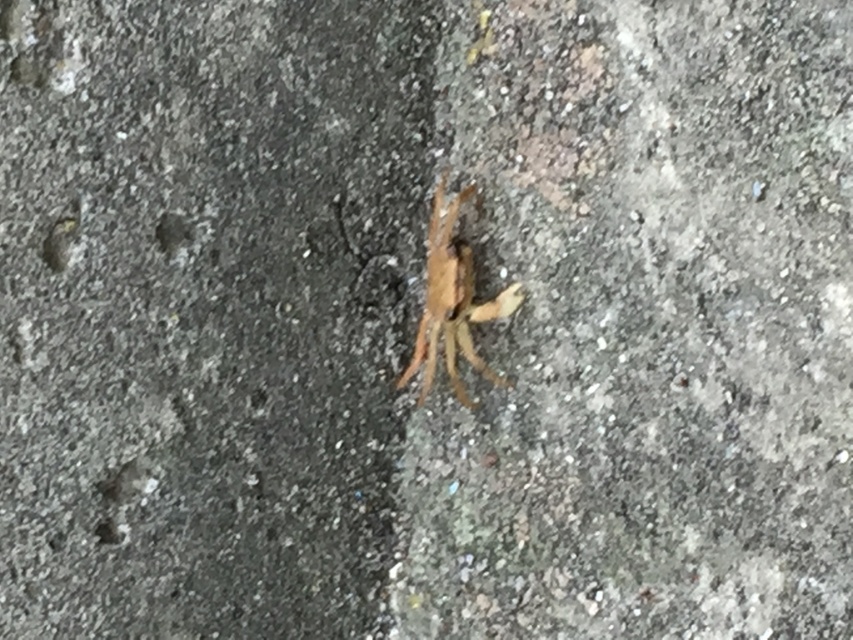
Question: Does gray rough concrete at center come behind brown rough concrete at center?

Choices:
 (A) yes
 (B) no

Answer: (B)

Question: Is brown rough concrete at center bigger than brown fuzzy spider at center?

Choices:
 (A) yes
 (B) no

Answer: (A)

Question: Which of these objects is positioned closest to the gray rough concrete at center?

Choices:
 (A) brown fuzzy spider at center
 (B) brown rough concrete at center

Answer: (A)

Question: Does brown rough concrete at center have a greater width compared to brown fuzzy spider at center?

Choices:
 (A) yes
 (B) no

Answer: (A)

Question: Which of the following is the farthest from the observer?

Choices:
 (A) (448, 326)
 (B) (660, 58)

Answer: (A)

Question: Estimate the real-world distances between objects in this image. Which object is closer to the brown rough concrete at center?

Choices:
 (A) gray rough concrete at center
 (B) brown fuzzy spider at center

Answer: (B)